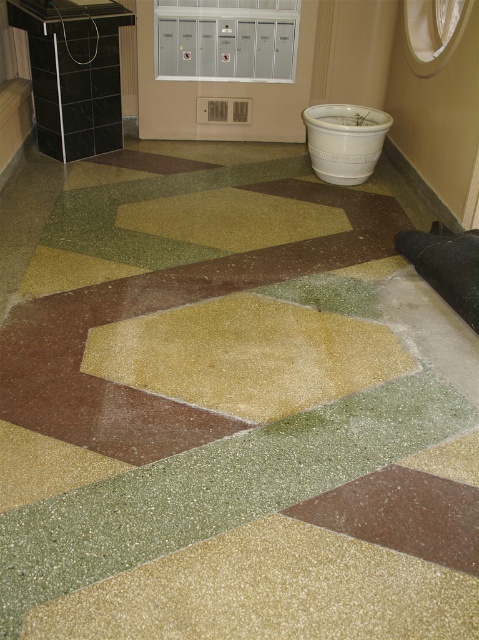
Question: Among these objects, which one is nearest to the camera?

Choices:
 (A) brown speckled tile at center
 (B) shiny gold hexagon at center

Answer: (A)

Question: Is brown speckled tile at center smaller than white ceramic pot at center?

Choices:
 (A) no
 (B) yes

Answer: (B)

Question: Considering the relative positions of brown speckled tile at center and white ceramic pot at center in the image provided, where is brown speckled tile at center located with respect to white ceramic pot at center?

Choices:
 (A) left
 (B) right

Answer: (A)

Question: Can you confirm if shiny gold hexagon at center is positioned to the right of white ceramic pot at center?

Choices:
 (A) no
 (B) yes

Answer: (A)

Question: Which of these objects is positioned farthest from the white ceramic pot at center?

Choices:
 (A) brown speckled tile at center
 (B) shiny gold hexagon at center

Answer: (A)

Question: Based on their relative distances, which object is farther from the white ceramic pot at center?

Choices:
 (A) brown speckled tile at center
 (B) shiny gold hexagon at center

Answer: (A)